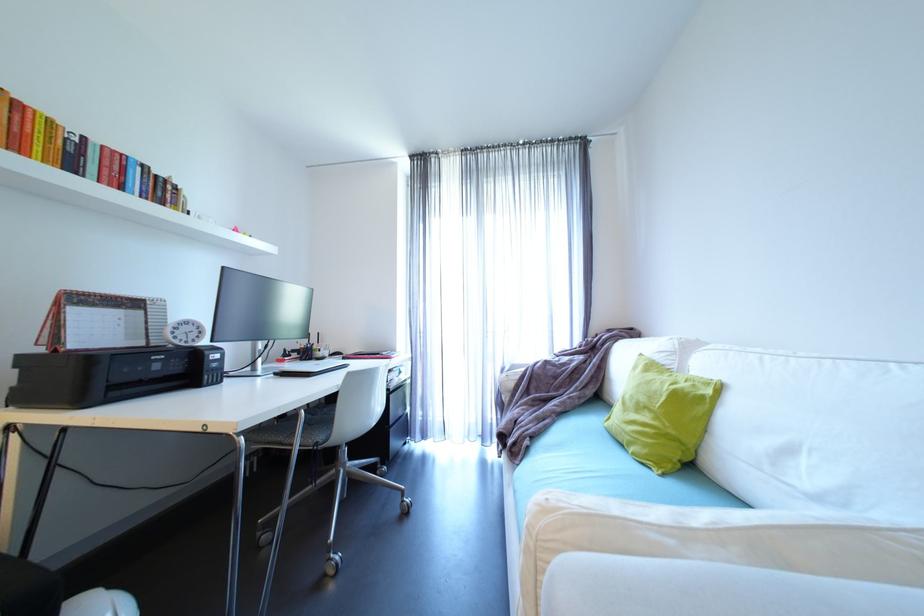
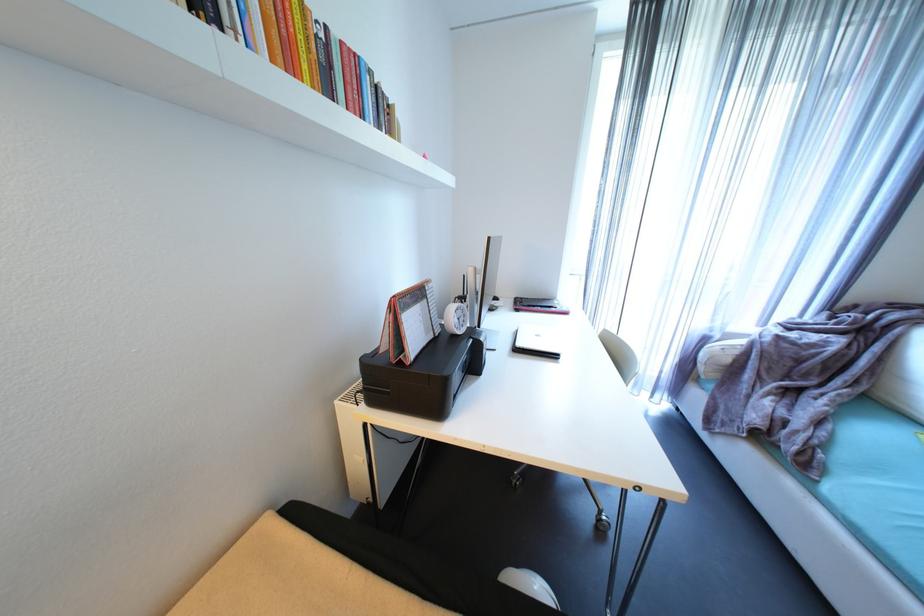
Question: What movement of the cameraman would produce the second image?

Choices:
 (A) Left
 (B) Right
 (C) Forward
 (D) Backward

Answer: (A)